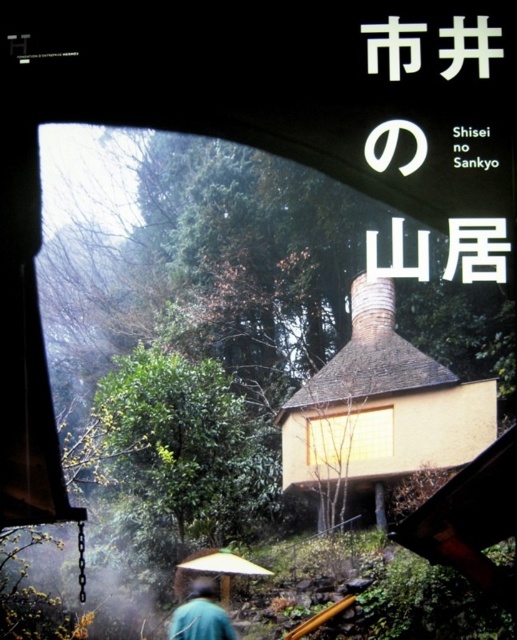
Which is in front, point (204, 598) or point (232, 554)?

Point (232, 554) is in front.

Identify the location of green matte jacket at lower center. This screenshot has width=517, height=640. (201, 614).